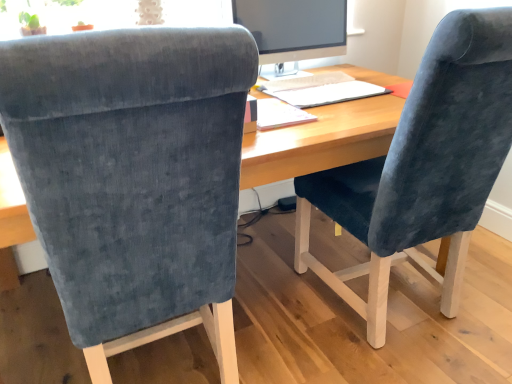
Where is `empty space that is to the right of white paper notepad at center`? The height and width of the screenshot is (384, 512). empty space that is to the right of white paper notepad at center is located at coordinates (348, 114).